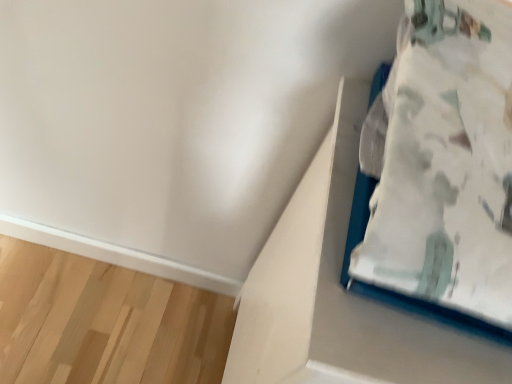
Question: Considering the relative sizes of white fabric bed at upper right and white matte cardboard box at upper right in the image provided, is white fabric bed at upper right shorter than white matte cardboard box at upper right?

Choices:
 (A) yes
 (B) no

Answer: (A)

Question: From the image's perspective, is white fabric bed at upper right under white matte cardboard box at upper right?

Choices:
 (A) no
 (B) yes

Answer: (A)

Question: Can you confirm if white fabric bed at upper right is smaller than white matte cardboard box at upper right?

Choices:
 (A) yes
 (B) no

Answer: (A)

Question: Is the position of white fabric bed at upper right less distant than that of white matte cardboard box at upper right?

Choices:
 (A) yes
 (B) no

Answer: (A)

Question: Is white fabric bed at upper right looking in the opposite direction of white matte cardboard box at upper right?

Choices:
 (A) yes
 (B) no

Answer: (B)

Question: Can you confirm if white fabric bed at upper right is taller than white matte cardboard box at upper right?

Choices:
 (A) no
 (B) yes

Answer: (A)

Question: Is white matte cardboard box at upper right positioned far away from white fabric bed at upper right?

Choices:
 (A) no
 (B) yes

Answer: (A)

Question: Would you say white matte cardboard box at upper right contains white fabric bed at upper right?

Choices:
 (A) no
 (B) yes

Answer: (A)

Question: From a real-world perspective, is white matte cardboard box at upper right over white fabric bed at upper right?

Choices:
 (A) no
 (B) yes

Answer: (A)

Question: Is white matte cardboard box at upper right positioned beyond the bounds of white fabric bed at upper right?

Choices:
 (A) yes
 (B) no

Answer: (A)

Question: From the image's perspective, is white matte cardboard box at upper right on white fabric bed at upper right?

Choices:
 (A) yes
 (B) no

Answer: (B)

Question: Is white matte cardboard box at upper right at the right side of white fabric bed at upper right?

Choices:
 (A) yes
 (B) no

Answer: (A)

Question: Considering the positions of point (394, 332) and point (496, 302), is point (394, 332) closer or farther from the camera than point (496, 302)?

Choices:
 (A) closer
 (B) farther

Answer: (B)